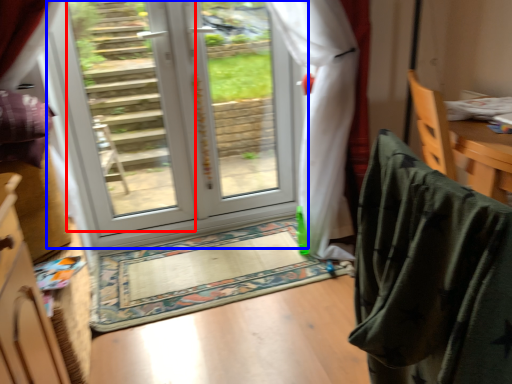
Question: Which point is closer to the camera, glass door (highlighted by a red box) or door (highlighted by a blue box)?

Choices:
 (A) glass door
 (B) door

Answer: (A)